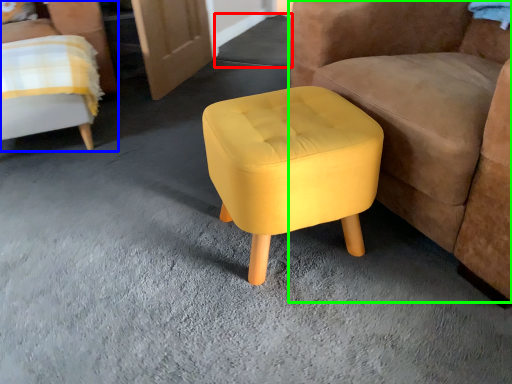
Question: Estimate the real-world distances between objects in this image. Which object is closer to concrete (highlighted by a red box), chair (highlighted by a blue box) or chair (highlighted by a green box)?

Choices:
 (A) chair
 (B) chair

Answer: (A)